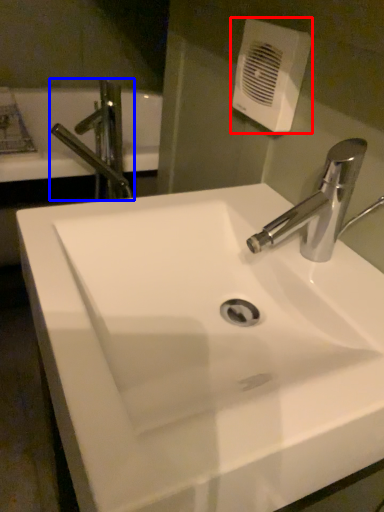
Question: Which object is further to the camera taking this photo, hand dryer (highlighted by a red box) or tap (highlighted by a blue box)?

Choices:
 (A) hand dryer
 (B) tap

Answer: (B)